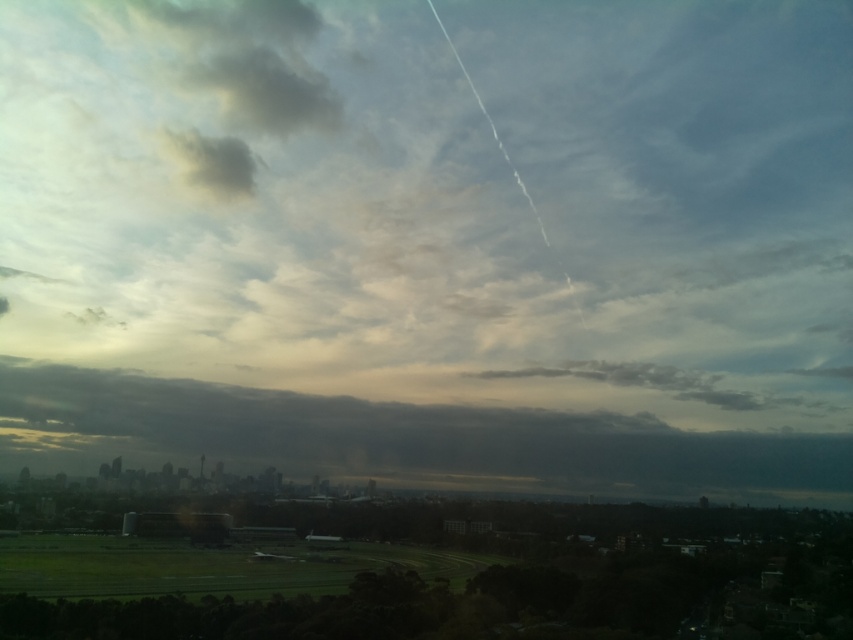
Is point (102, 385) closer to viewer compared to point (241, 156)?

That is False.

Which is behind, point (740, 460) or point (167, 131)?

Point (740, 460)

Does point (206, 401) lie behind point (236, 141)?

Yes, point (206, 401) is behind point (236, 141).

The height and width of the screenshot is (640, 853). Find the location of `dark gray cloud at center`. dark gray cloud at center is located at coordinates (393, 438).